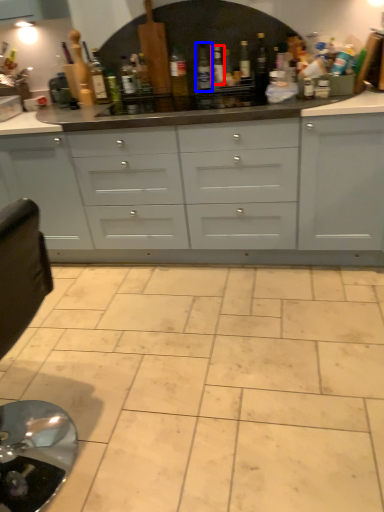
Question: Which point is further to the camera, bottle (highlighted by a red box) or bottle (highlighted by a blue box)?

Choices:
 (A) bottle
 (B) bottle

Answer: (A)